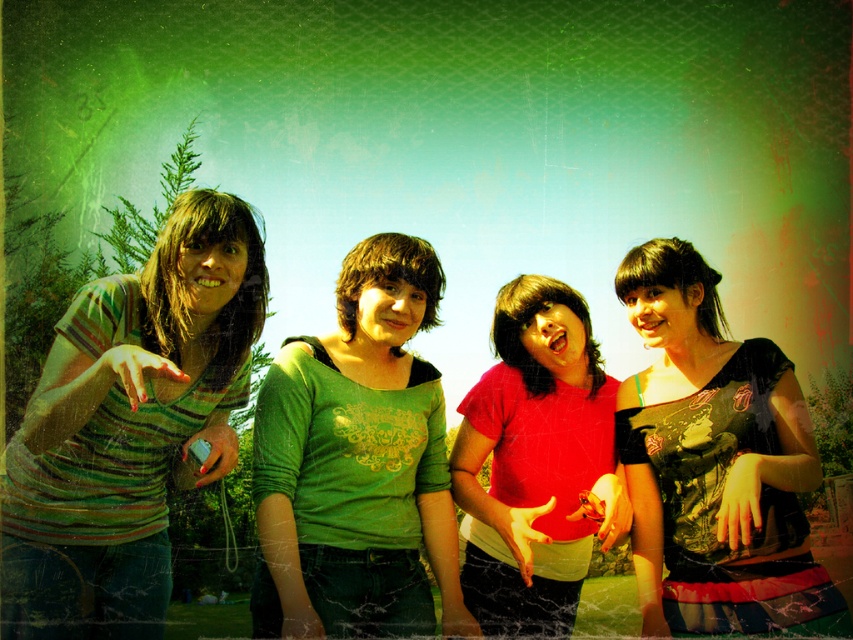
Can you confirm if green matte shirt at center is taller than matte black dress at center?

Indeed, green matte shirt at center has a greater height compared to matte black dress at center.

Is green matte shirt at center smaller than matte black dress at center?

Actually, green matte shirt at center might be larger than matte black dress at center.

Does point (403, 433) lie behind point (646, 317)?

No, it is in front of (646, 317).

Find the location of `green matte shirt at center`. green matte shirt at center is located at coordinates (357, 461).

Which of these two, striped cotton shirt at left or green matte shirt at center, stands shorter?

green matte shirt at center is shorter.

Consider the image. Measure the distance between striped cotton shirt at left and green matte shirt at center.

The distance of striped cotton shirt at left from green matte shirt at center is 33.84 inches.

Where is `striped cotton shirt at left`? The width and height of the screenshot is (853, 640). striped cotton shirt at left is located at coordinates (129, 426).

You are a GUI agent. You are given a task and a screenshot of the screen. Output one action in this format:
    pyautogui.click(x=<x>, y=<y>)
    Task: Click on the striped cotton shirt at left
    Image resolution: width=853 pixels, height=640 pixels.
    Given the screenshot: What is the action you would take?
    pyautogui.click(x=129, y=426)

Does point (91, 308) come behind point (469, 444)?

No, it is not.

Does point (177, 353) come closer to viewer compared to point (502, 435)?

Yes.

Locate an element on the screen. Image resolution: width=853 pixels, height=640 pixels. striped cotton shirt at left is located at coordinates (129, 426).